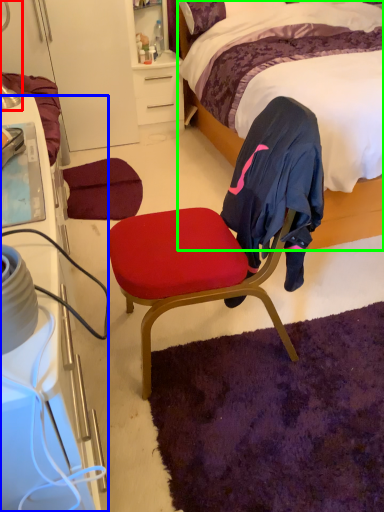
Question: Which object is the farthest from table lamp (highlighted by a red box)? Choose among these: cabinetry (highlighted by a blue box) or bed (highlighted by a green box).

Choices:
 (A) cabinetry
 (B) bed

Answer: (B)